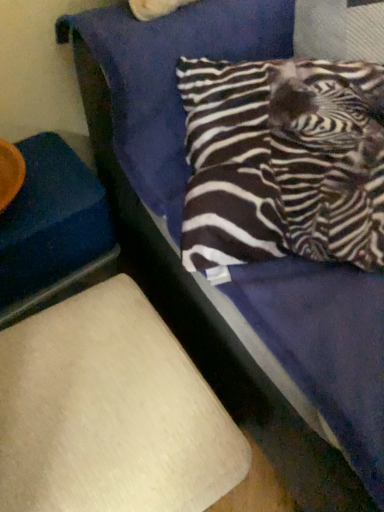
Identify the location of vacant area on top of beige fabric lampshade at lower left, the 2th furniture viewed from the top (from a real-world perspective). The width and height of the screenshot is (384, 512). (94, 401).